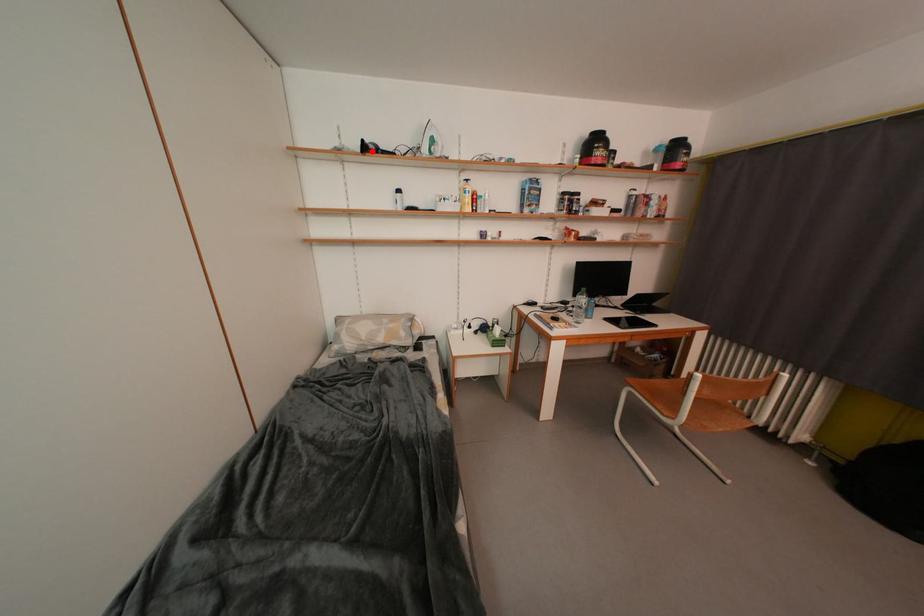
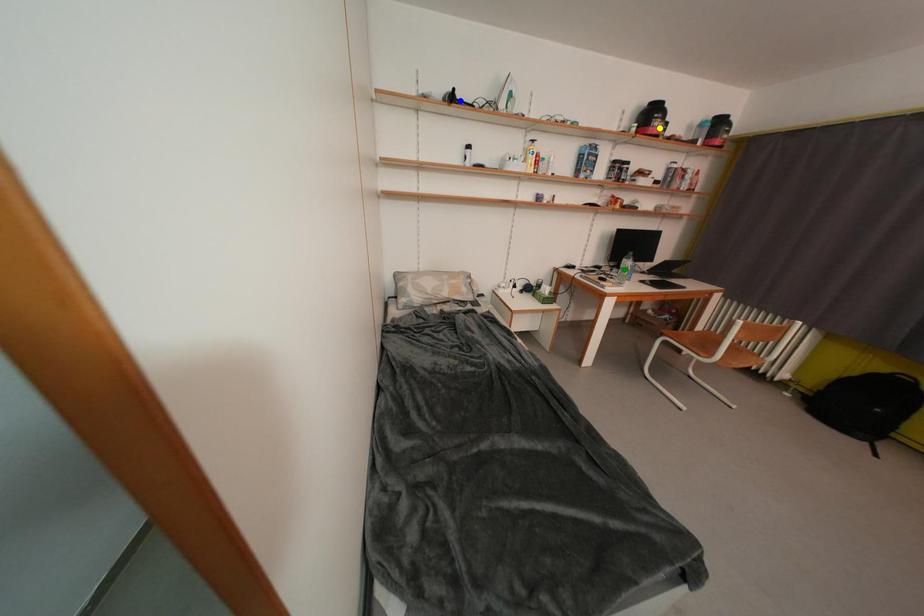
Question: I am providing you with two images of the same scene from different viewpoints. A red point is marked on the first image. You are given multiple points on the second image. Which point in image 2 represents the same 3d spot as the red point in image 1?

Choices:
 (A) blue point
 (B) yellow point
 (C) green point

Answer: (A)